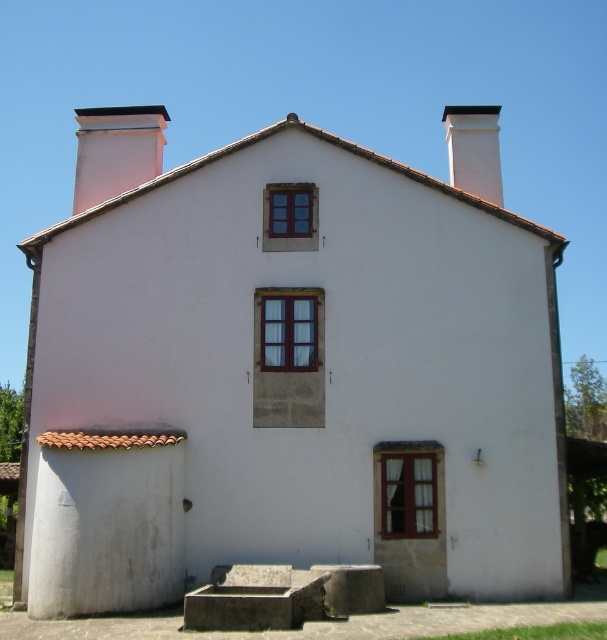
You are standing in front of the building and want to locate the white smooth chimney at upper left. What are its coordinates?

The white smooth chimney at upper left is located at coordinates point (117,150).

You are standing in front of the two story white building. You see the white smooth chimney at upper left and the white smooth chimney at upper center. Which one is closer to you?

The white smooth chimney at upper left is closer to you because it is in front of the white smooth chimney at upper center.